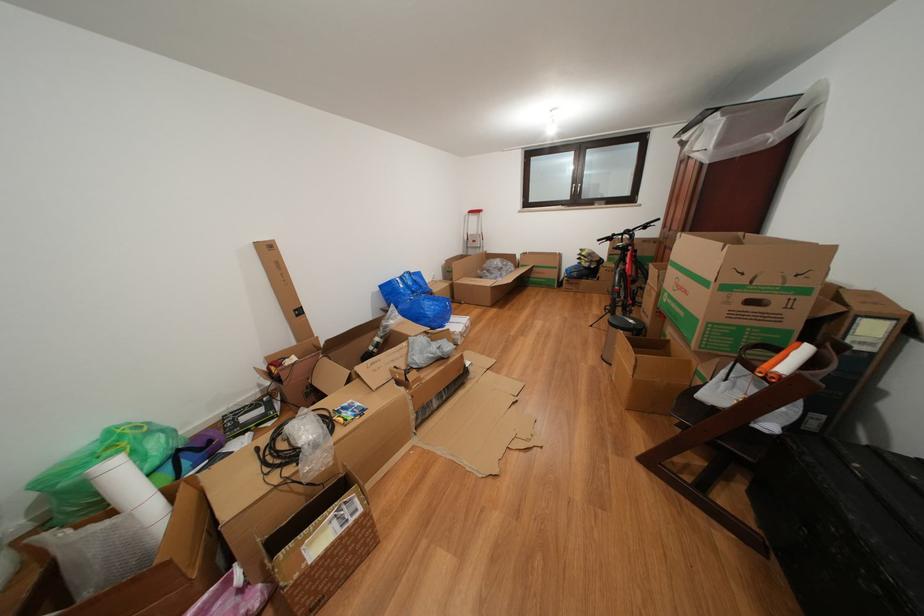
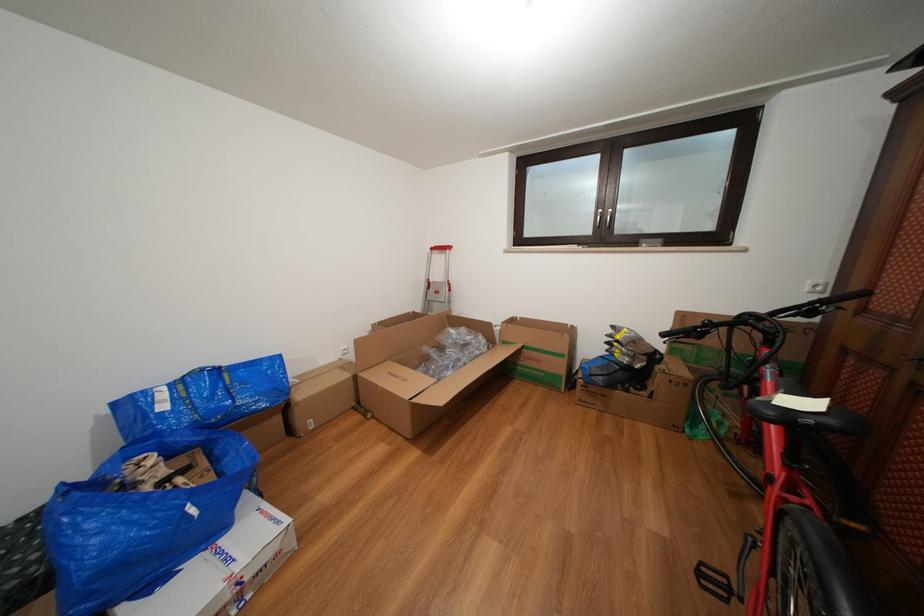
The point at (614, 315) is marked in the first image. Where is the corresponding point in the second image?

(708, 578)